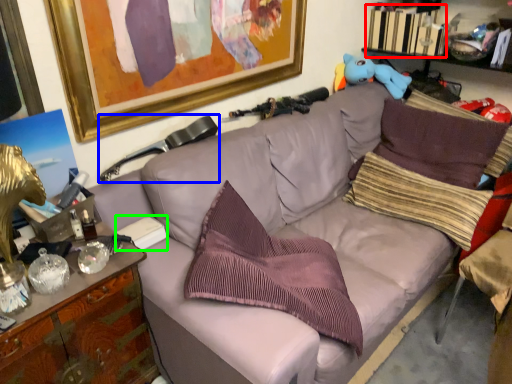
Question: Which object is the farthest from book (highlighted by a red box)? Choose among these: swivel chair (highlighted by a blue box) or book (highlighted by a green box).

Choices:
 (A) swivel chair
 (B) book

Answer: (B)